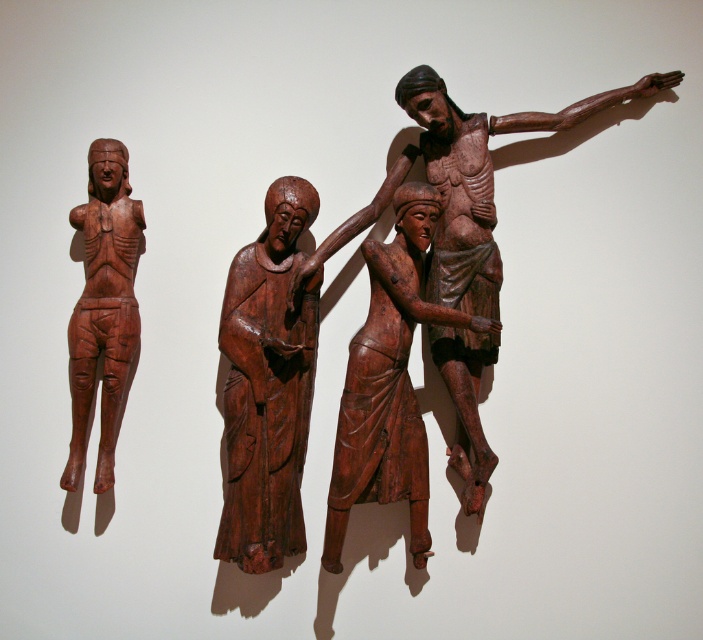
Question: Does wooden crucifix at center appear on the left side of matte wood figure at left?

Choices:
 (A) no
 (B) yes

Answer: (A)

Question: Among these objects, which one is farthest from the camera?

Choices:
 (A) smooth brown statue at center
 (B) matte wood figure at left
 (C) wooden figure at center
 (D) wooden crucifix at center

Answer: (B)

Question: Is wooden crucifix at center further to the viewer compared to wooden figure at center?

Choices:
 (A) yes
 (B) no

Answer: (A)

Question: Does smooth brown statue at center have a smaller size compared to wooden crucifix at center?

Choices:
 (A) no
 (B) yes

Answer: (B)

Question: Which object is the closest to the wooden crucifix at center?

Choices:
 (A) smooth brown statue at center
 (B) wooden figure at center

Answer: (B)

Question: Which of the following is the farthest from the observer?

Choices:
 (A) matte wood figure at left
 (B) wooden crucifix at center
 (C) wooden figure at center

Answer: (A)